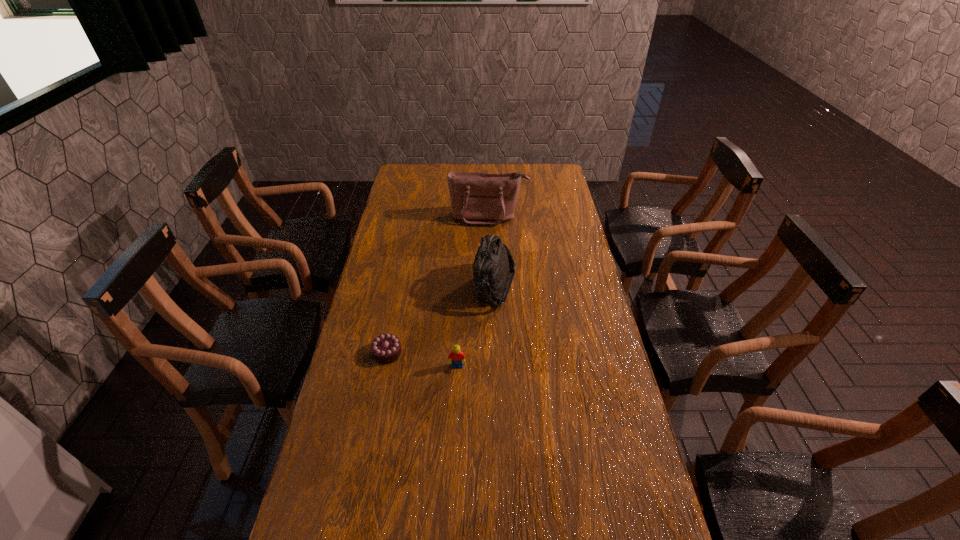
Where is `vacant space that is in between the farther shoulder bag and the Lego`? This screenshot has height=540, width=960. vacant space that is in between the farther shoulder bag and the Lego is located at coordinates (473, 292).

Locate an element on the screen. free point between the leftmost object and the Lego is located at coordinates (422, 360).

Identify the location of empty space that is in between the Lego and the third nearest object. The width and height of the screenshot is (960, 540). (476, 327).

Where is `free space between the Lego and the shortest object`? This screenshot has height=540, width=960. free space between the Lego and the shortest object is located at coordinates (422, 360).

Where is `object that is the closest one to the farther shoulder bag`? The image size is (960, 540). object that is the closest one to the farther shoulder bag is located at coordinates (493, 271).

Select which object appears as the closest to the second shortest object. Please provide its 2D coordinates. Your answer should be formatted as a tuple, i.e. [(x, y)], where the tuple contains the x and y coordinates of a point satisfying the conditions above.

[(386, 348)]

The width and height of the screenshot is (960, 540). Identify the location of vacant space that satisfies the following two spatial constraints: 1. at the front padded panel of the nearer shoulder bag; 2. on the face of the Lego. (498, 367).